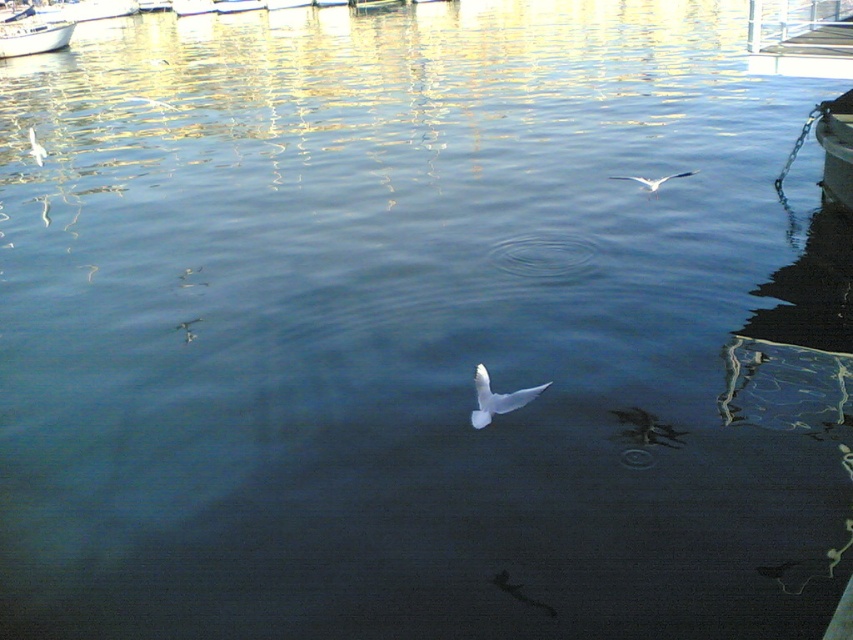
You are a photographer trying to capture the white feathered bird at center and the white matte bird at upper left in a single shot. Based on their positions, which bird appears lower in the frame?

The white feathered bird at center appears lower in the frame than the white matte bird at upper left.

You are standing at the edge of the marina and see both the white feathered bird at center and the white matte bird at upper left. Which bird is closer to you?

The white feathered bird at center is closer to you since it is only 23.05 meters away from the white matte bird at upper left, meaning it is nearer than the other bird.

You are a photographer positioned at the center of the image. You want to capture a shot of the white glossy boat at upper left without including the white bird in the frame. Based on their positions, is this possible?

The white glossy boat at upper left is located at point (33, 36), so yes, the photographer can position themselves to capture the white glossy boat at upper left without including the white bird in the frame by adjusting their angle or zoom to exclude the bird.